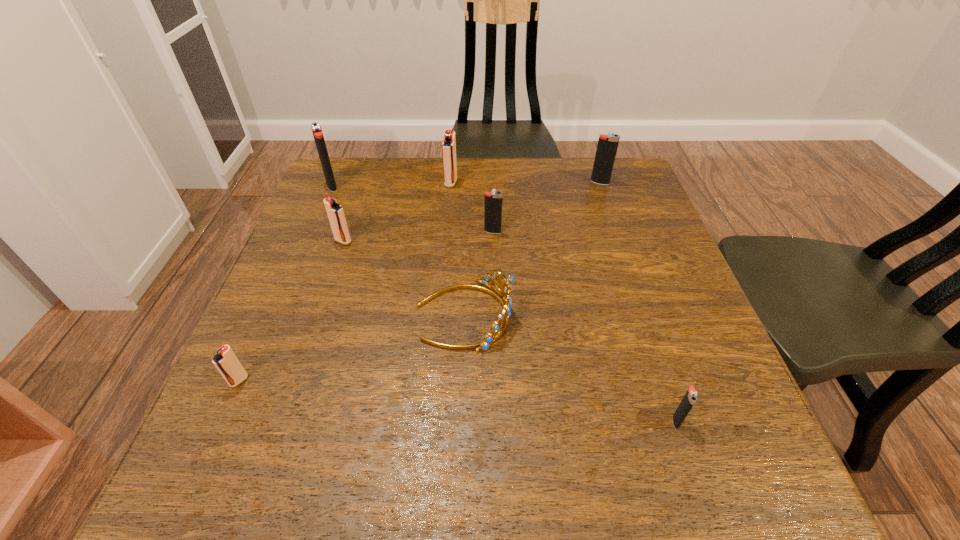
This screenshot has height=540, width=960. I want to click on vacant region between the nearest black igniter and the fifth igniter from right to left, so click(x=510, y=331).

The image size is (960, 540). Identify the location of vacant space in between the rightmost red igniter and the nearest object. (564, 302).

You are a GUI agent. You are given a task and a screenshot of the screen. Output one action in this format:
    pyautogui.click(x=<x>, y=<y>)
    Task: Click on the vacant space that is in between the leftmost red igniter and the rightmost red igniter
    
    Given the screenshot: What is the action you would take?
    pyautogui.click(x=345, y=282)

I want to click on free point between the second biggest black igniter and the third nearest igniter, so click(x=471, y=212).

The image size is (960, 540). In order to click on vacant space in between the second smallest red igniter and the second nearest igniter in this screenshot , I will do `click(291, 311)`.

The image size is (960, 540). Identify the location of free spot between the second biggest black igniter and the biggest red igniter. (525, 183).

Identify the location of vacant point located between the third nearest object and the second nearest red igniter. pyautogui.click(x=403, y=278).

The width and height of the screenshot is (960, 540). In order to click on free spot between the third smallest black igniter and the third biggest black igniter in this screenshot , I will do `click(546, 207)`.

You are a GUI agent. You are given a task and a screenshot of the screen. Output one action in this format:
    pyautogui.click(x=<x>, y=<y>)
    Task: Click on the free point between the smallest black igniter and the sixth farthest object
    The width and height of the screenshot is (960, 540).
    Given the screenshot: What is the action you would take?
    pyautogui.click(x=570, y=368)

This screenshot has height=540, width=960. What are the coordinates of `vacant space that is in between the third smallest black igniter and the tallest igniter` in the screenshot? It's located at (466, 184).